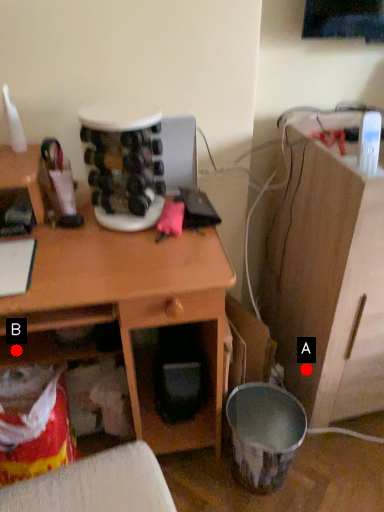
Question: Two points are circled on the image, labeled by A and B beside each circle. Which point is farther from the camera taking this photo?

Choices:
 (A) A is further
 (B) B is further

Answer: (A)